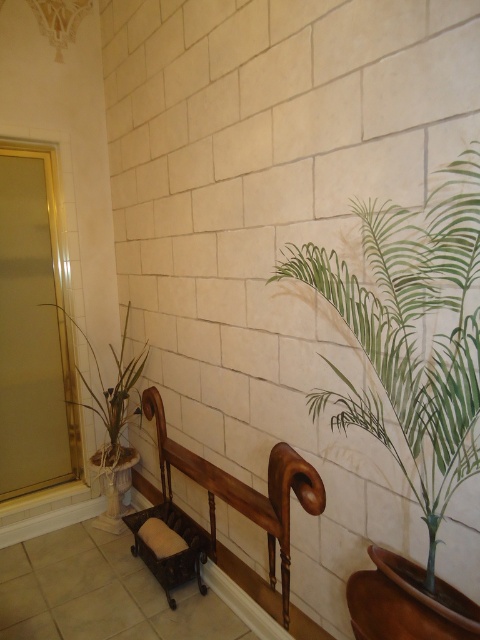
Is green leafy plant at right to the right of green leafy plant at left from the viewer's perspective?

Indeed, green leafy plant at right is positioned on the right side of green leafy plant at left.

Which of these two, green leafy plant at right or green leafy plant at left, stands taller?

With more height is green leafy plant at right.

What are the coordinates of `green leafy plant at right` in the screenshot? It's located at (410, 333).

Does green leafy plant at right appear on the right side of brown polished wood bench at center?

Correct, you'll find green leafy plant at right to the right of brown polished wood bench at center.

Who is more distant from viewer, (361, 406) or (317, 500)?

Positioned behind is point (317, 500).

Image resolution: width=480 pixels, height=640 pixels. I want to click on green leafy plant at right, so click(x=410, y=333).

Is brown polished wood bench at center bigger than green leafy plant at left?

Indeed, brown polished wood bench at center has a larger size compared to green leafy plant at left.

Does brown polished wood bench at center have a greater height compared to green leafy plant at left?

No.

Locate an element on the screen. The height and width of the screenshot is (640, 480). brown polished wood bench at center is located at coordinates (241, 492).